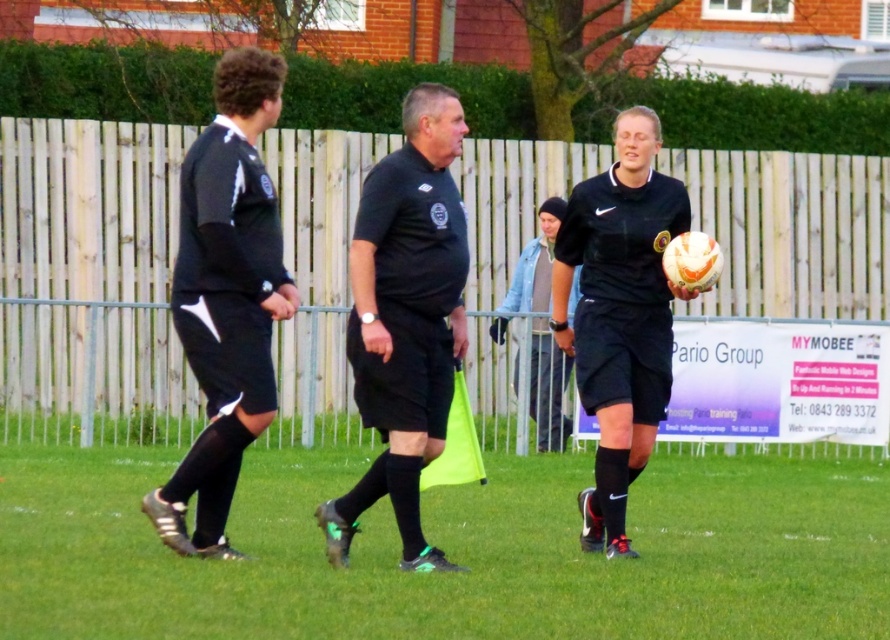
Can you confirm if black synthetic turf at center is wider than denim jacket at center?

Incorrect, black synthetic turf at center's width does not surpass denim jacket at center's.

Does point (846, 557) come farther from viewer compared to point (545, 236)?

That is False.

You are a GUI agent. You are given a task and a screenshot of the screen. Output one action in this format:
    pyautogui.click(x=<x>, y=<y>)
    Task: Click on the black synthetic turf at center
    
    Given the screenshot: What is the action you would take?
    pyautogui.click(x=450, y=552)

This screenshot has width=890, height=640. Find the location of `black synthetic turf at center`. black synthetic turf at center is located at coordinates (450, 552).

Is point (448, 92) behind point (538, 337)?

No, it is not.

Is black matte shirt at center above denim jacket at center?

No.

Is point (398, 317) positioned after point (543, 252)?

That is False.

The width and height of the screenshot is (890, 640). I want to click on black matte shirt at center, so click(405, 320).

Is black synthetic turf at center wider than wooden fence at center?

Incorrect, black synthetic turf at center's width does not surpass wooden fence at center's.

Which is in front, point (53, 561) or point (379, 138)?

Point (53, 561) is in front.

Find the location of a particular element. This screenshot has width=890, height=640. black synthetic turf at center is located at coordinates (450, 552).